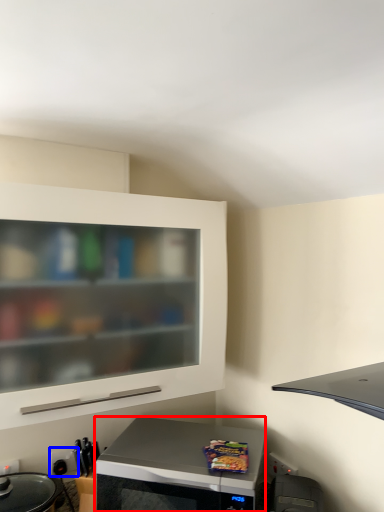
Question: Which object is further to the camera taking this photo, microwave oven (highlighted by a red box) or electric outlet (highlighted by a blue box)?

Choices:
 (A) microwave oven
 (B) electric outlet

Answer: (B)